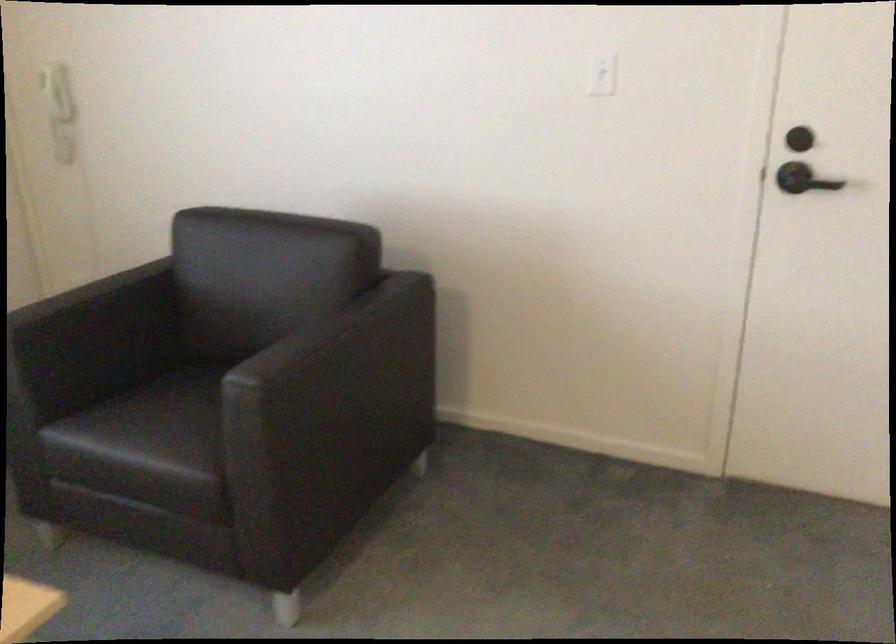
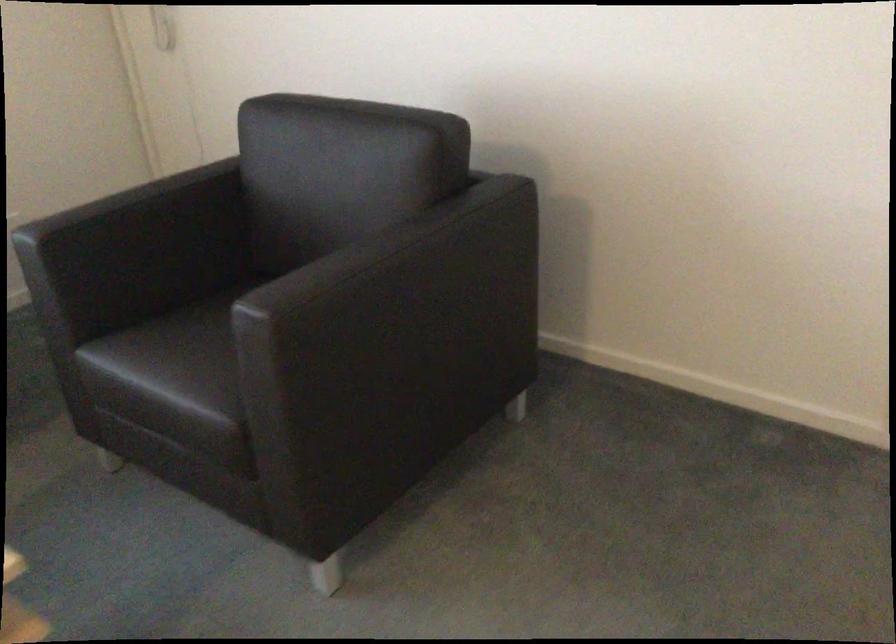
Locate, in the second image, the point that corresponds to pixel 357 328 in the first image.

(419, 249)